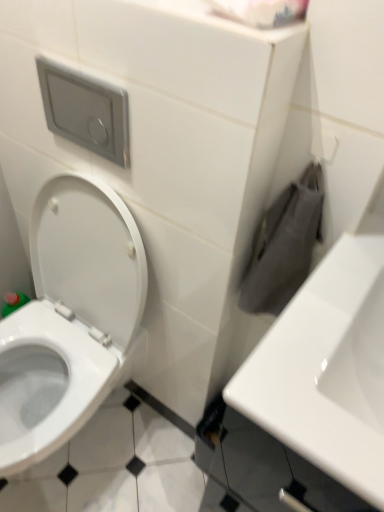
Question: Is the surface of white glossy sink at right in direct contact with white matte toilet paper at upper center?

Choices:
 (A) yes
 (B) no

Answer: (B)

Question: Does white glossy sink at right appear on the right side of white matte toilet paper at upper center?

Choices:
 (A) yes
 (B) no

Answer: (A)

Question: Is white glossy sink at right positioned with its back to white matte toilet paper at upper center?

Choices:
 (A) no
 (B) yes

Answer: (A)

Question: Is white glossy sink at right thinner than white matte toilet paper at upper center?

Choices:
 (A) yes
 (B) no

Answer: (B)

Question: From a real-world perspective, is white glossy sink at right physically below white matte toilet paper at upper center?

Choices:
 (A) yes
 (B) no

Answer: (A)

Question: Is white glossy sink at right positioned behind white matte toilet paper at upper center?

Choices:
 (A) yes
 (B) no

Answer: (B)

Question: Would you say white glossy toilet at left is a long distance from white glossy sink at right?

Choices:
 (A) no
 (B) yes

Answer: (A)

Question: Is white glossy toilet at left taller than white glossy sink at right?

Choices:
 (A) yes
 (B) no

Answer: (A)

Question: Can you confirm if white glossy toilet at left is wider than white glossy sink at right?

Choices:
 (A) yes
 (B) no

Answer: (A)

Question: Considering the relative positions of white glossy toilet at left and white glossy sink at right in the image provided, is white glossy toilet at left to the left of white glossy sink at right from the viewer's perspective?

Choices:
 (A) no
 (B) yes

Answer: (B)

Question: Is white glossy toilet at left oriented away from white glossy sink at right?

Choices:
 (A) yes
 (B) no

Answer: (B)

Question: Could you tell me if white glossy toilet at left is turned towards white glossy sink at right?

Choices:
 (A) yes
 (B) no

Answer: (B)

Question: Does white glossy sink at right touch white glossy toilet at left?

Choices:
 (A) no
 (B) yes

Answer: (A)